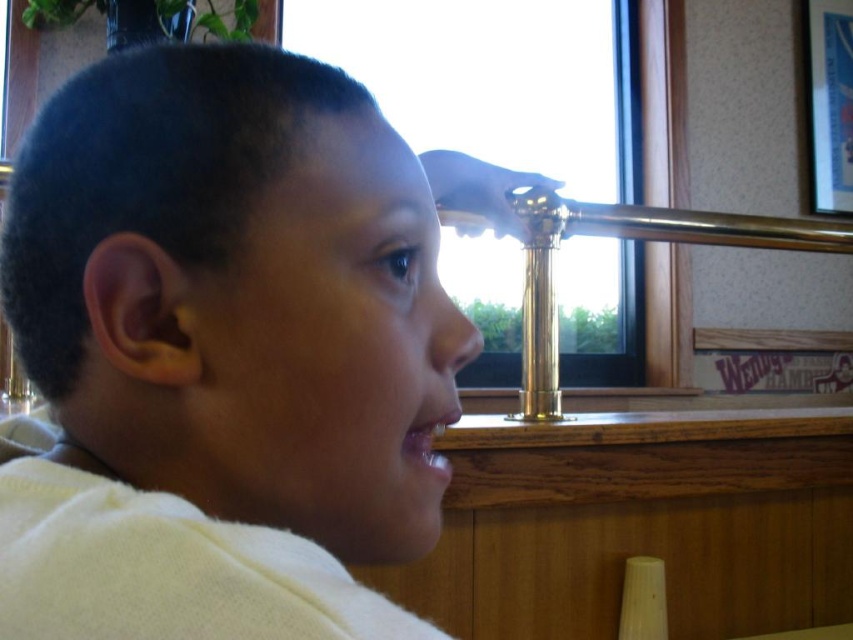
You are a photographer trying to capture a shot of the transparent glass window at center while ensuring the white matte shirt at center is visible in the frame. Based on their positions, can you include both in the same photo without moving either object?

The white matte shirt at center is to the left of transparent glass window at center, so yes, you can include both in the same photo by positioning the camera to capture the area where the white matte shirt at center is on the left side and the transparent glass window at center is on the right side of the frame.

You are a photographer trying to capture the boy in the scene. Since you want to focus on his clothing, you need to position the camera so that the white matte shirt at center is not obstructed by the transparent glass window at center. Based on their positions, can you position the camera so that the shirt is visible without the window blocking it?

The white matte shirt at center is located below the transparent glass window at center, so positioning the camera below the window would allow the shirt to be visible without obstruction from the window.

You are a photographer trying to capture the boy in the scene. The white matte shirt at center and the transparent glass window at center are both in your viewfinder. Which object should you adjust your focus on if you want to ensure the smaller one is sharp?

The white matte shirt at center is smaller than the transparent glass window at center, so you should focus on the white matte shirt at center to ensure the smaller object is sharp.